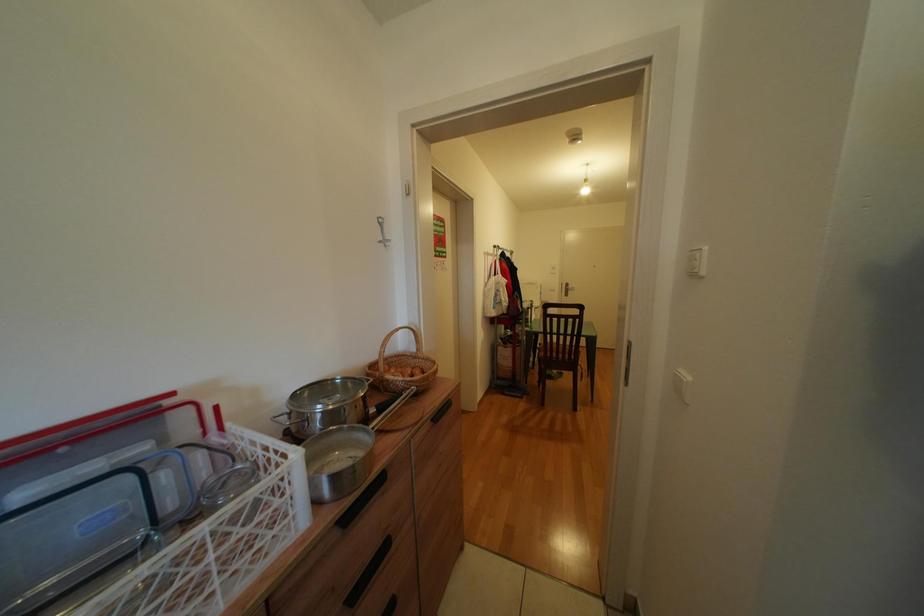
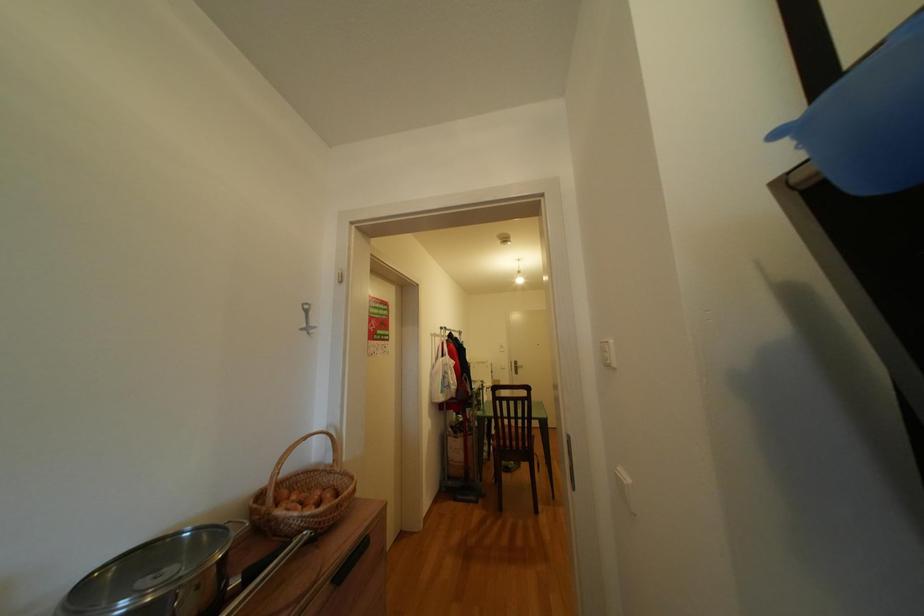
Question: In a continuous first-person perspective shot, in which direction is the camera moving?

Choices:
 (A) Left
 (B) Right
 (C) Forward
 (D) Backward

Answer: (B)